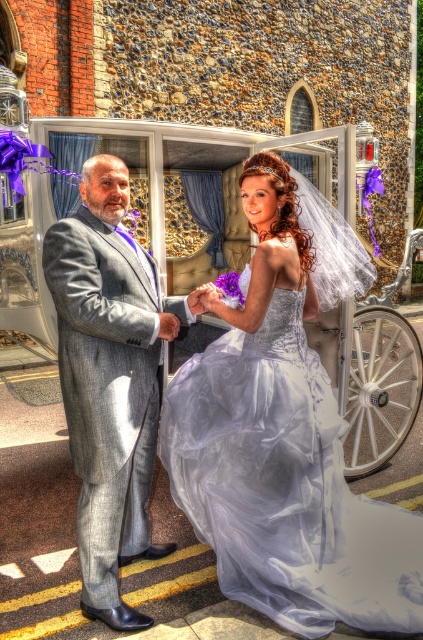
Which of these two, silvery tulle dress at center or white wood cart at center, stands taller?

Standing taller between the two is silvery tulle dress at center.

Can you confirm if silvery tulle dress at center is thinner than white wood cart at center?

No.

Who is more distant from viewer, (x=194, y=460) or (x=206, y=337)?

The point (x=206, y=337) is more distant.

Locate an element on the screen. The width and height of the screenshot is (423, 640). silvery tulle dress at center is located at coordinates (285, 484).

Who is positioned more to the right, silvery tulle dress at center or gray wool suit at center?

From the viewer's perspective, silvery tulle dress at center appears more on the right side.

Is silvery tulle dress at center smaller than gray wool suit at center?

No.

Between point (205, 451) and point (101, 492), which one is positioned behind?

The point (205, 451) is behind.

At what (x,y) coordinates should I click in order to perform the action: click on silvery tulle dress at center. Please return your answer as a coordinate pair (x, y). The height and width of the screenshot is (640, 423). Looking at the image, I should click on (285, 484).

I want to click on white wood cart at center, so click(x=205, y=168).

Can you confirm if white wood cart at center is positioned above gray wool suit at center?

No, white wood cart at center is not above gray wool suit at center.

Locate an element on the screen. white wood cart at center is located at coordinates (205, 168).

Locate an element on the screen. The width and height of the screenshot is (423, 640). white wood cart at center is located at coordinates (205, 168).